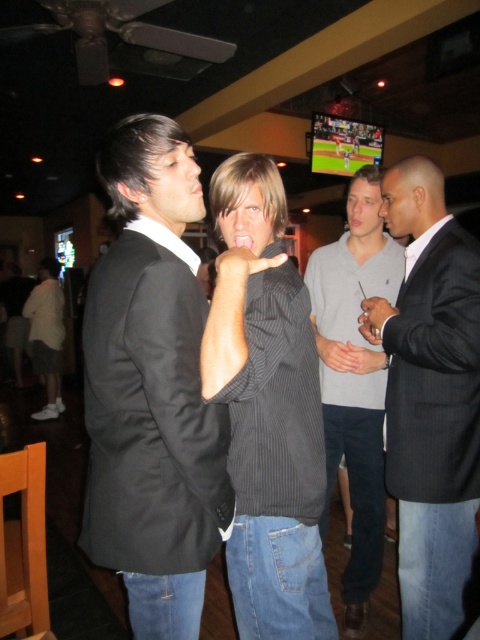
Question: Which of the following is the farthest from the observer?

Choices:
 (A) black matte suit at center
 (B) gray cotton sweater at center
 (C) white cotton shirt at lower left
 (D) black pinstripe sweater at center

Answer: (C)

Question: From the image, what is the correct spatial relationship of black pinstripe suit at right in relation to white cotton shirt at lower left?

Choices:
 (A) right
 (B) left

Answer: (A)

Question: Which is farther from the black pinstripe suit at right?

Choices:
 (A) dark gray pinstripe suit at right
 (B) white cotton shirt at lower left
 (C) black pinstripe sweater at center

Answer: (B)

Question: Observing the image, what is the correct spatial positioning of black matte suit at center in reference to dark gray pinstripe suit at right?

Choices:
 (A) right
 (B) left

Answer: (B)

Question: Which is nearer to the black pinstripe sweater at center?

Choices:
 (A) black matte suit at center
 (B) white cotton shirt at lower left

Answer: (A)

Question: Does black matte suit at center appear under dark gray pinstripe suit at right?

Choices:
 (A) yes
 (B) no

Answer: (A)